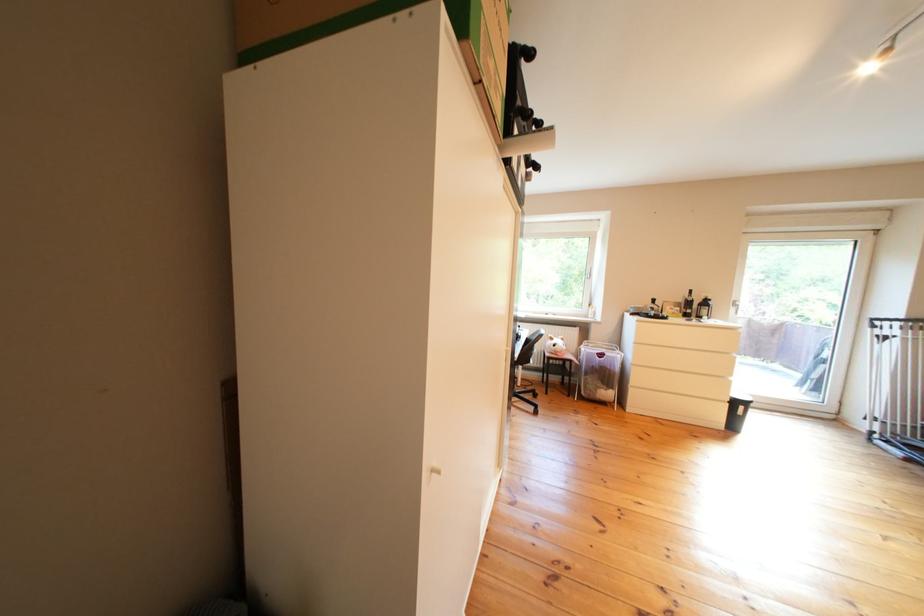
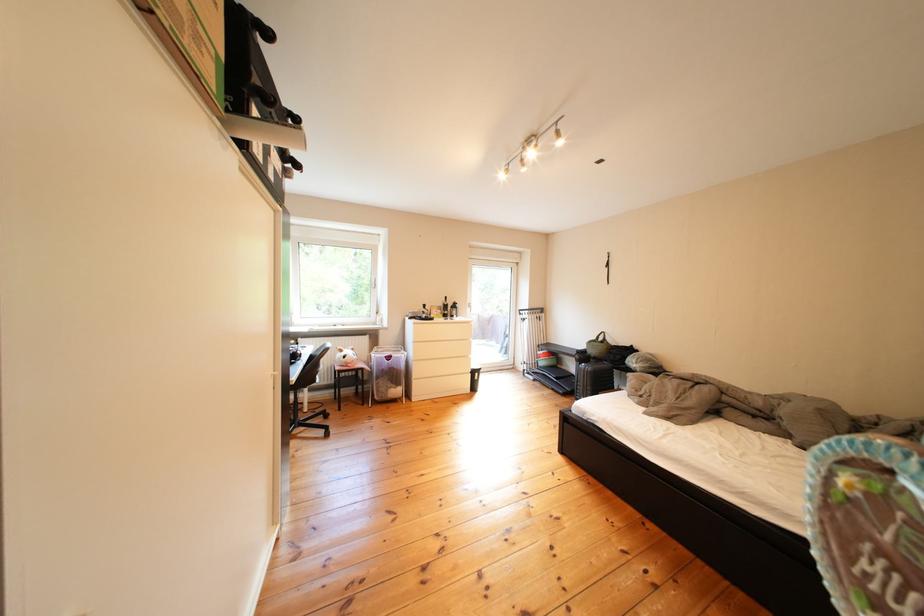
Find the pixel in the second image that matches (601,378) in the first image.

(392, 382)